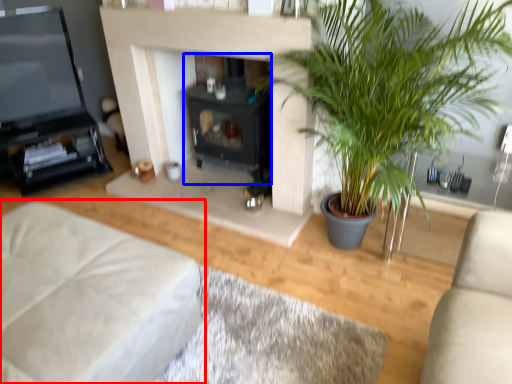
Question: Which of the following is the farthest to the observer, studio couch (highlighted by a red box) or fireplace (highlighted by a blue box)?

Choices:
 (A) studio couch
 (B) fireplace

Answer: (B)